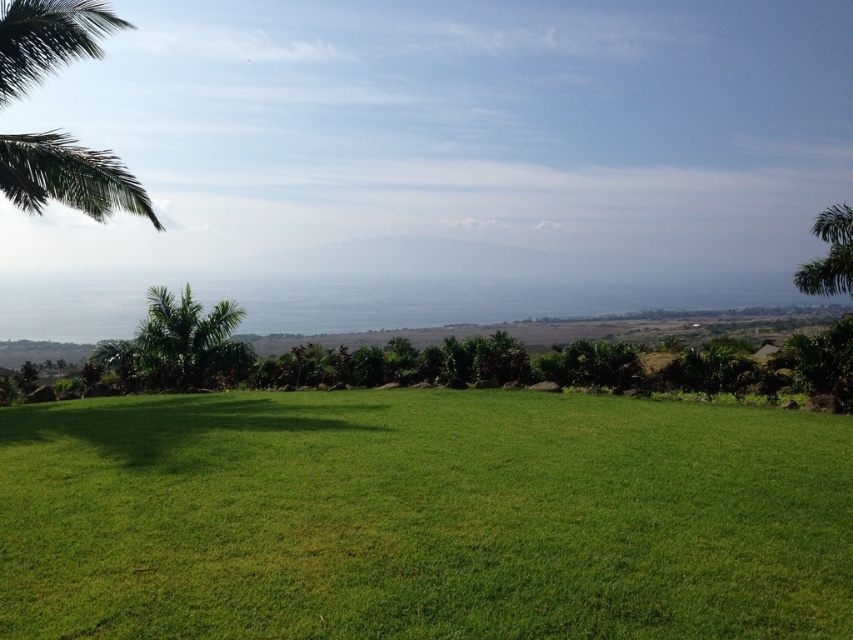
Can you confirm if green leafy palm at upper left is thinner than green leafy palm tree at lower left?

In fact, green leafy palm at upper left might be wider than green leafy palm tree at lower left.

Which of these two, green leafy palm at upper left or green leafy palm tree at lower left, stands shorter?

Standing shorter between the two is green leafy palm tree at lower left.

Image resolution: width=853 pixels, height=640 pixels. What do you see at coordinates (67, 177) in the screenshot?
I see `green leafy palm at upper left` at bounding box center [67, 177].

This screenshot has height=640, width=853. Find the location of `green leafy palm at upper left`. green leafy palm at upper left is located at coordinates (67, 177).

Can you confirm if green grassy field at center is positioned to the left of green leafy palm at upper left?

No, green grassy field at center is not to the left of green leafy palm at upper left.

Can you confirm if green grassy field at center is thinner than green leafy palm at upper left?

Indeed, green grassy field at center has a lesser width compared to green leafy palm at upper left.

Between point (776, 545) and point (51, 154), which one is positioned in front?

Positioned in front is point (776, 545).

You are a GUI agent. You are given a task and a screenshot of the screen. Output one action in this format:
    pyautogui.click(x=<x>, y=<y>)
    Task: Click on the green grassy field at center
    The image size is (853, 640).
    Given the screenshot: What is the action you would take?
    pyautogui.click(x=422, y=516)

Is green grassy field at center thinner than green leafy palm tree at right?

Correct, green grassy field at center's width is less than green leafy palm tree at right's.

The image size is (853, 640). Identify the location of green grassy field at center. point(422,516).

At what (x,y) coordinates should I click in order to perform the action: click on green grassy field at center. Please return your answer as a coordinate pair (x, y). Looking at the image, I should click on (422, 516).